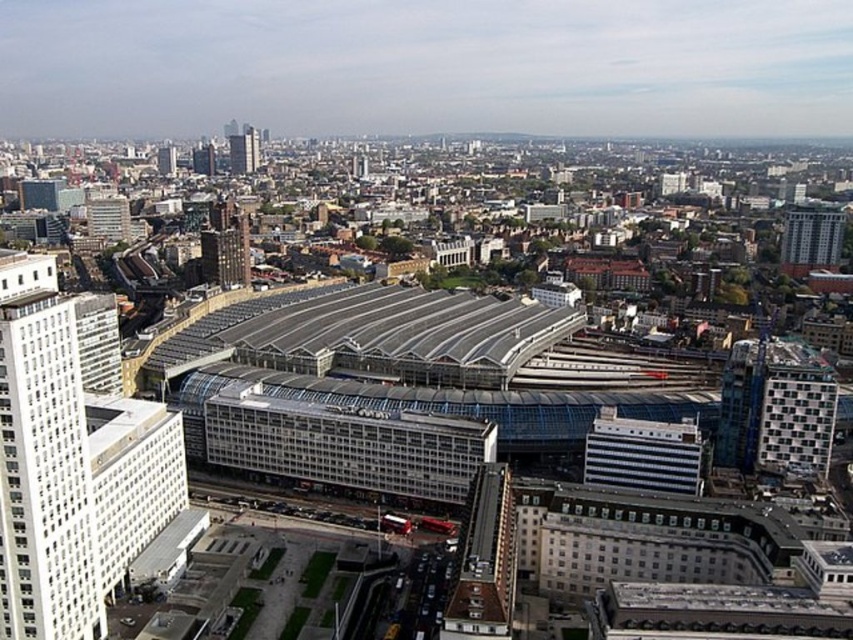
You are a drone operator who needs to deliver a package to the white glass building at left. The delivery zone is marked by point coordinates. Is the point marked by coordinates point (44, 461) located to the left or right of the white glass building at left?

The point marked by coordinates point (44, 461) is located at the white glass building at left, so it is exactly at the building.

You are standing at the railway station and want to reach a specific point marked at coordinates point (515, 557). If your walking speed is 1.5 meters per second, how many seconds will it take you to reach that point?

The point (515, 557) is 126.26 meters away from the viewer. At a walking speed of 1.5 meters per second, it would take approximately 84.17 seconds to reach the point.